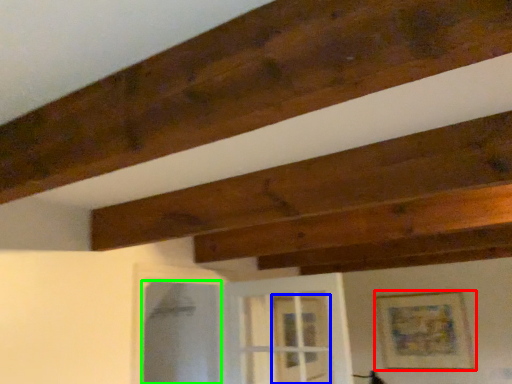
Question: Which is farther away from picture frame (highlighted by a red box)? glass door (highlighted by a blue box) or screen door (highlighted by a green box)?

Choices:
 (A) glass door
 (B) screen door

Answer: (B)